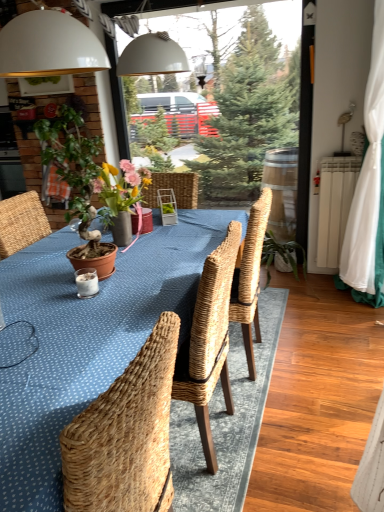
At what (x,y) coordinates should I click in order to perform the action: click on vacant space to the left of terracotta pot at left. Please return your answer as a coordinate pair (x, y). Image resolution: width=384 pixels, height=512 pixels. Looking at the image, I should click on (36, 286).